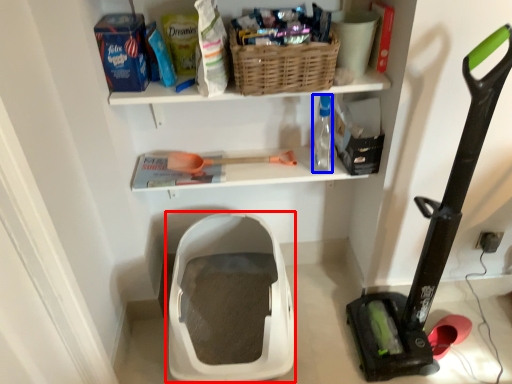
Question: Which object appears farthest to the camera in this image, storage box (highlighted by a red box) or bottle (highlighted by a blue box)?

Choices:
 (A) storage box
 (B) bottle

Answer: (B)